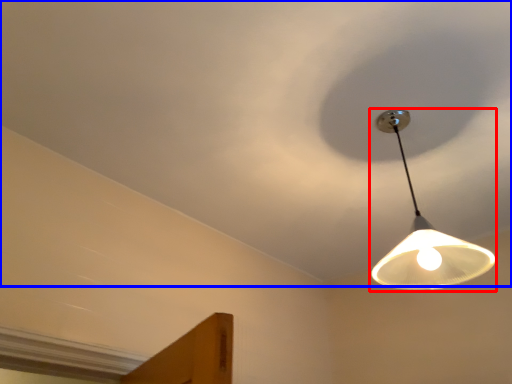
Question: Among these objects, which one is nearest to the camera, lamp (highlighted by a red box) or cloud (highlighted by a blue box)?

Choices:
 (A) lamp
 (B) cloud

Answer: (B)